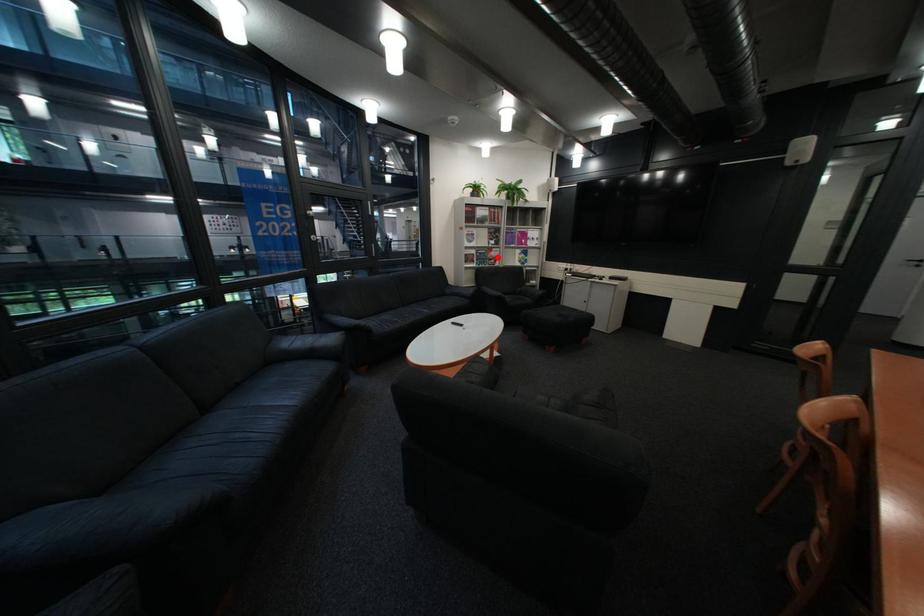
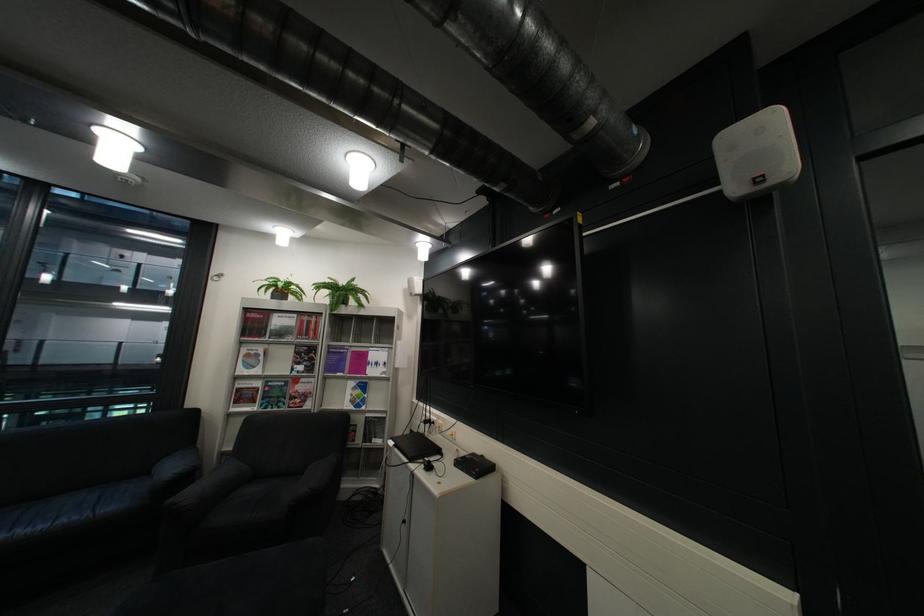
Where in the second image is the point corresponding to the highlighted location from the first image?

(290, 394)